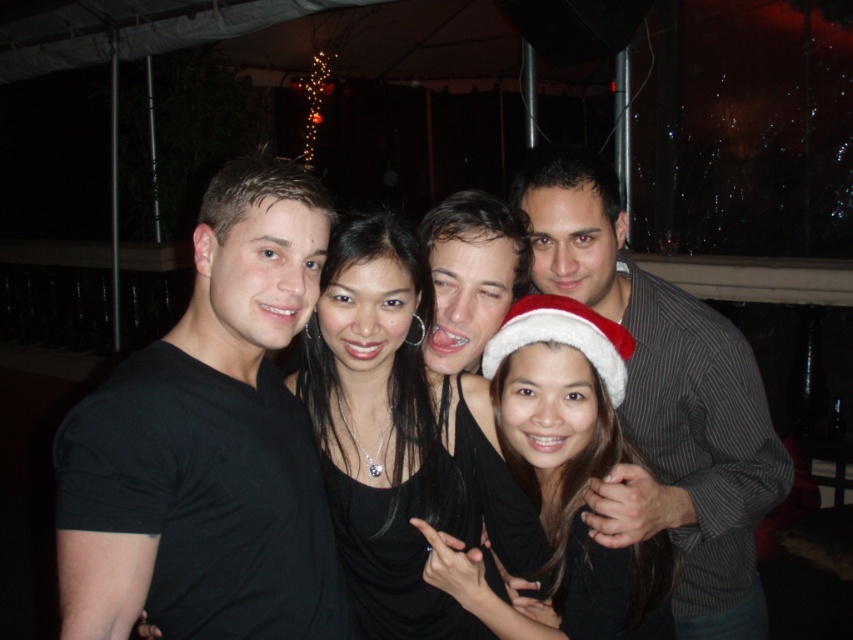
Question: Which is farther from the black matte dress at center?

Choices:
 (A) striped fabric shirt at right
 (B) white fluffy santa hat at center

Answer: (A)

Question: From the image, what is the correct spatial relationship of black matte t-shirt at left in relation to shiny metallic face at center?

Choices:
 (A) below
 (B) above

Answer: (A)

Question: Which point is closer to the camera?

Choices:
 (A) (619, 371)
 (B) (409, 241)
 (C) (503, 282)

Answer: (A)

Question: Is black matte t-shirt at left bigger than shiny metallic face at center?

Choices:
 (A) no
 (B) yes

Answer: (B)

Question: Which point appears closest to the camera in this image?

Choices:
 (A) (708, 364)
 (B) (267, 419)
 (C) (479, 500)

Answer: (B)

Question: Considering the relative positions of striped fabric shirt at right and shiny metallic face at center in the image provided, where is striped fabric shirt at right located with respect to shiny metallic face at center?

Choices:
 (A) right
 (B) left

Answer: (A)